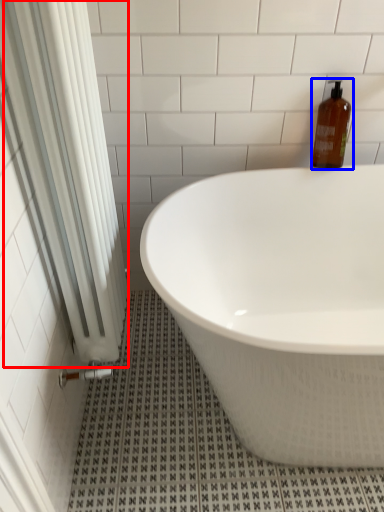
Question: Which of the following is the closest to the observer, shower curtain (highlighted by a red box) or bottle (highlighted by a blue box)?

Choices:
 (A) shower curtain
 (B) bottle

Answer: (A)